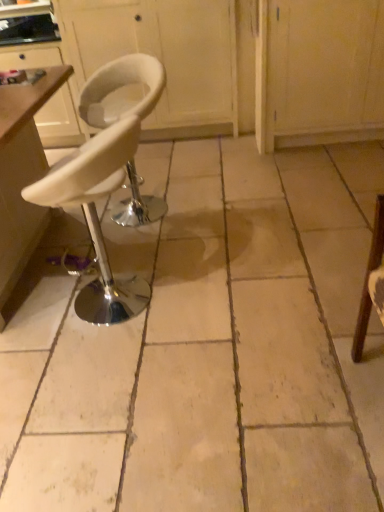
You are a GUI agent. You are given a task and a screenshot of the screen. Output one action in this format:
    pyautogui.click(x=<x>, y=<y>)
    Task: Click on the free space underneath white matte stool at center, the second chair in the front-to-back sequence (from a real-world perspective)
    This screenshot has height=512, width=384.
    Given the screenshot: What is the action you would take?
    pyautogui.click(x=146, y=212)